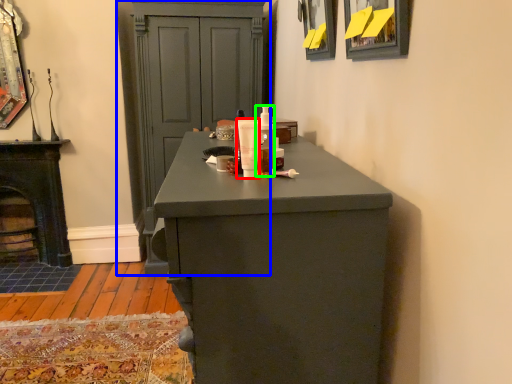
Question: Considering the real-world distances, which object is closest to mouthwash (highlighted by a red box)? cupboard (highlighted by a blue box) or mouthwash (highlighted by a green box).

Choices:
 (A) cupboard
 (B) mouthwash

Answer: (B)